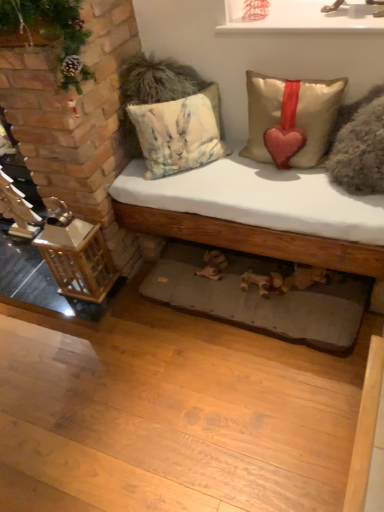
The image size is (384, 512). I want to click on free space in front of gray fabric mat at lower center, so [x=243, y=413].